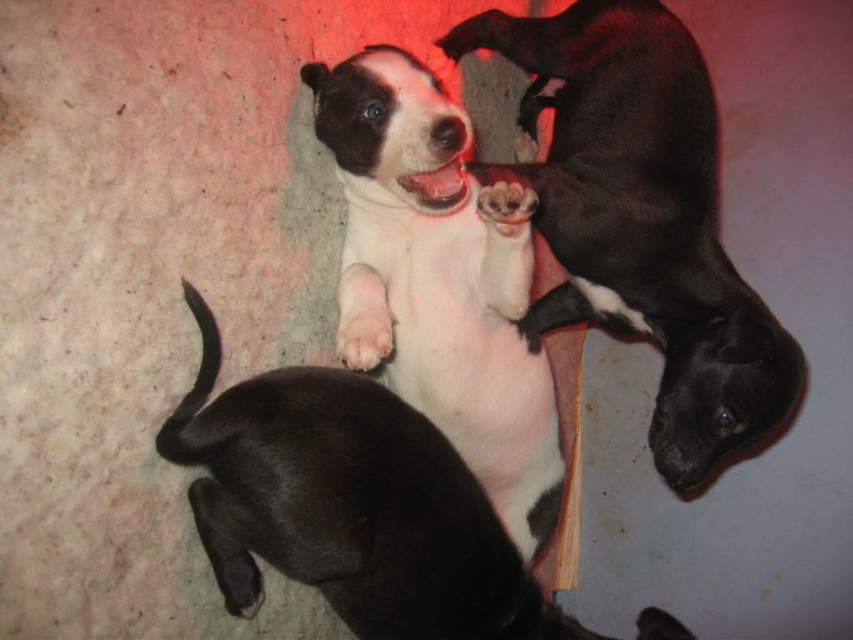
Question: From the image, what is the correct spatial relationship of white matte dog at center in relation to white soft paw at center?

Choices:
 (A) right
 (B) left

Answer: (B)

Question: Among these objects, which one is nearest to the camera?

Choices:
 (A) white smooth puppy at center
 (B) white soft fur at center
 (C) white soft paw at center

Answer: (B)

Question: Which object is the farthest from the white soft paw at center?

Choices:
 (A) white soft fur at center
 (B) white matte dog at center

Answer: (A)

Question: Which point is closer to the camera taking this photo?

Choices:
 (A) (431, 339)
 (B) (711, 148)
 (C) (482, 204)
 (D) (222, 472)

Answer: (D)

Question: Does white smooth puppy at center have a greater width compared to white soft paw at center?

Choices:
 (A) yes
 (B) no

Answer: (A)

Question: Is white smooth puppy at center above white soft paw at center?

Choices:
 (A) yes
 (B) no

Answer: (A)